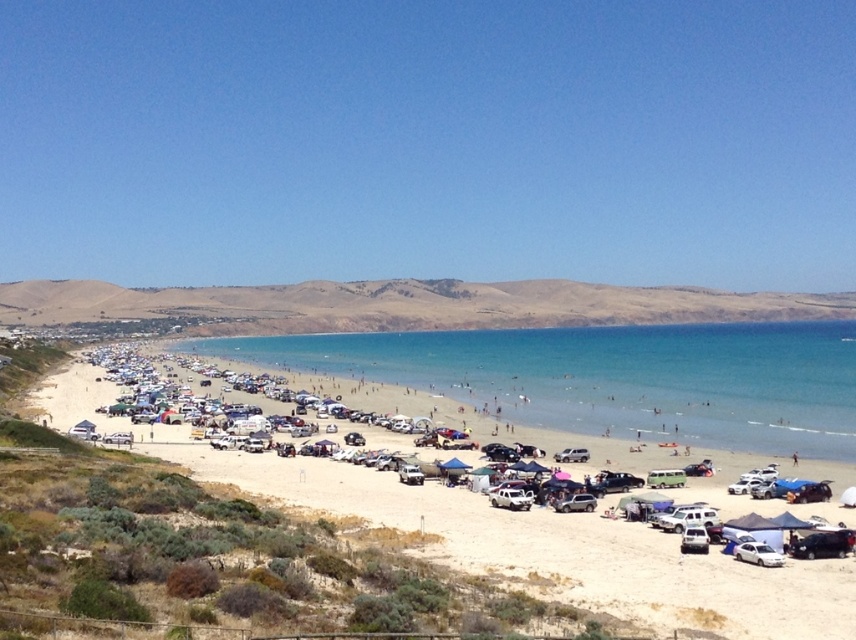
Question: Is white sand beach at lower center further to camera compared to white matte car at lower right?

Choices:
 (A) no
 (B) yes

Answer: (A)

Question: Among these objects, which one is farthest from the camera?

Choices:
 (A) white matte car at lower right
 (B) clear blue water at center
 (C) white sand beach at lower center
 (D) brown/dry grassy hillside at upper center

Answer: (D)

Question: Can you confirm if clear blue water at center is positioned to the right of white matte car at lower right?

Choices:
 (A) no
 (B) yes

Answer: (B)

Question: Does clear blue water at center come behind white matte car at lower right?

Choices:
 (A) no
 (B) yes

Answer: (B)

Question: Which of the following is the closest to the observer?

Choices:
 (A) brown/dry grassy hillside at upper center
 (B) clear blue water at center

Answer: (B)

Question: Which point appears closest to the camera in this image?

Choices:
 (A) (91, 378)
 (B) (648, 364)

Answer: (A)